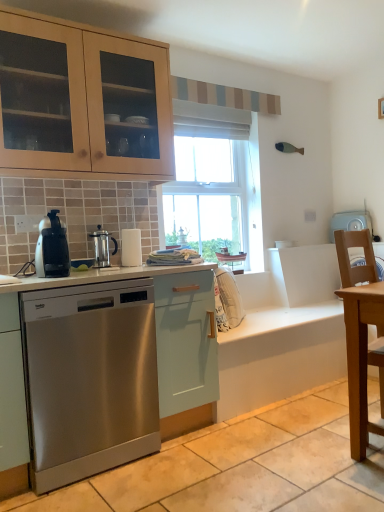
Question: Is satin silver coffee press at center to the left of stainless steel dishwasher at left from the viewer's perspective?

Choices:
 (A) yes
 (B) no

Answer: (B)

Question: Does satin silver coffee press at center appear on the right side of stainless steel dishwasher at left?

Choices:
 (A) no
 (B) yes

Answer: (B)

Question: Can you confirm if satin silver coffee press at center is wider than stainless steel dishwasher at left?

Choices:
 (A) yes
 (B) no

Answer: (B)

Question: Does satin silver coffee press at center turn towards stainless steel dishwasher at left?

Choices:
 (A) no
 (B) yes

Answer: (A)

Question: Can we say satin silver coffee press at center lies outside stainless steel dishwasher at left?

Choices:
 (A) no
 (B) yes

Answer: (B)

Question: Does satin silver coffee press at center have a greater height compared to stainless steel dishwasher at left?

Choices:
 (A) no
 (B) yes

Answer: (A)

Question: Is satin black coffee maker at left taller than light blue plastic washing machine at right?

Choices:
 (A) no
 (B) yes

Answer: (A)

Question: Would you consider satin black coffee maker at left to be distant from light blue plastic washing machine at right?

Choices:
 (A) yes
 (B) no

Answer: (A)

Question: Is satin black coffee maker at left placed right next to light blue plastic washing machine at right?

Choices:
 (A) no
 (B) yes

Answer: (A)

Question: Considering the relative positions of satin black coffee maker at left and light blue plastic washing machine at right in the image provided, is satin black coffee maker at left in front of light blue plastic washing machine at right?

Choices:
 (A) no
 (B) yes

Answer: (B)

Question: Considering the relative sizes of satin black coffee maker at left and light blue plastic washing machine at right in the image provided, is satin black coffee maker at left bigger than light blue plastic washing machine at right?

Choices:
 (A) yes
 (B) no

Answer: (B)

Question: From the image's perspective, is satin black coffee maker at left on light blue plastic washing machine at right?

Choices:
 (A) yes
 (B) no

Answer: (B)

Question: Considering the relative sizes of light brown wooden table at right and satin black coffee maker at left in the image provided, is light brown wooden table at right shorter than satin black coffee maker at left?

Choices:
 (A) yes
 (B) no

Answer: (B)